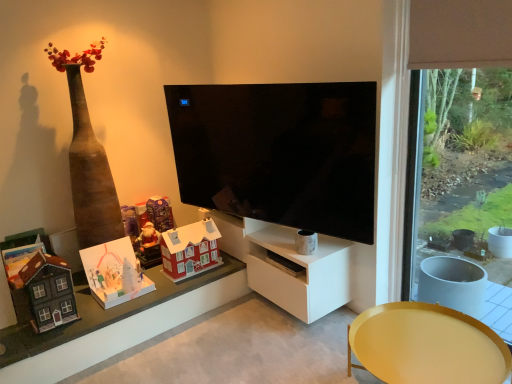
Question: From the image's perspective, is matte red house at center, which appears as the third toy when viewed from the front, on matte red house at lower left?

Choices:
 (A) yes
 (B) no

Answer: (A)

Question: From a real-world perspective, is matte red house at center, which appears as the third toy when viewed from the front, positioned over matte red house at lower left based on gravity?

Choices:
 (A) no
 (B) yes

Answer: (B)

Question: Is matte red house at center, which appears as the third toy when viewed from the front, wider than matte red house at lower left?

Choices:
 (A) yes
 (B) no

Answer: (B)

Question: Can you confirm if matte red house at center, which appears as the third toy when viewed from the front, is positioned to the right of matte red house at lower left?

Choices:
 (A) no
 (B) yes

Answer: (B)

Question: Is matte red house at center, which appears as the third toy when viewed from the front, positioned before matte red house at lower left?

Choices:
 (A) yes
 (B) no

Answer: (B)

Question: From the image's perspective, is matte yellow tray at lower right above or below brown wood frame at right?

Choices:
 (A) above
 (B) below

Answer: (B)

Question: Based on their sizes in the image, would you say matte yellow tray at lower right is bigger or smaller than brown wood frame at right?

Choices:
 (A) small
 (B) big

Answer: (B)

Question: From their relative heights in the image, would you say matte yellow tray at lower right is taller or shorter than brown wood frame at right?

Choices:
 (A) short
 (B) tall

Answer: (A)

Question: From a real-world perspective, is matte yellow tray at lower right above or below brown wood frame at right?

Choices:
 (A) below
 (B) above

Answer: (A)

Question: From their relative heights in the image, would you say matte plastic santa at center, positioned as the second toy in back-to-front order, is taller or shorter than matte red house at center, acting as the third toy starting from the back?

Choices:
 (A) short
 (B) tall

Answer: (A)

Question: Considering the positions of point (129, 233) and point (160, 235), is point (129, 233) closer or farther from the camera than point (160, 235)?

Choices:
 (A) closer
 (B) farther

Answer: (B)

Question: In terms of size, does matte plastic santa at center, positioned as the second toy in back-to-front order, appear bigger or smaller than matte red house at center, which appears as the third toy when viewed from the front?

Choices:
 (A) big
 (B) small

Answer: (B)

Question: From a real-world perspective, is matte plastic santa at center, which is the fourth toy in front-to-back order, positioned above or below matte red house at center, which appears as the third toy when viewed from the front?

Choices:
 (A) above
 (B) below

Answer: (B)

Question: From the image's perspective, is matte purple cardboard at upper left, the 5th toy when ordered from front to back, positioned above or below matte red house at lower left?

Choices:
 (A) below
 (B) above

Answer: (B)

Question: Considering the relative positions of matte purple cardboard at upper left, the 5th toy when ordered from front to back, and matte red house at lower left in the image provided, is matte purple cardboard at upper left, the 5th toy when ordered from front to back, to the left or to the right of matte red house at lower left?

Choices:
 (A) left
 (B) right

Answer: (B)